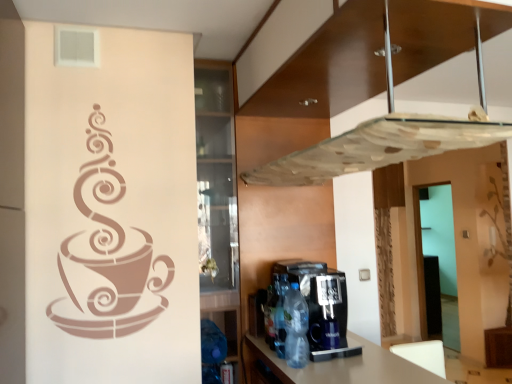
Describe the element at coordinates (439, 261) in the screenshot. The image size is (512, 384). I see `transparent glass door at right` at that location.

The width and height of the screenshot is (512, 384). What do you see at coordinates (322, 307) in the screenshot?
I see `black plastic coffee machine at lower center` at bounding box center [322, 307].

Image resolution: width=512 pixels, height=384 pixels. What do you see at coordinates (331, 65) in the screenshot?
I see `transparent glass exhaust hood at upper center` at bounding box center [331, 65].

Measure the distance between translucent plastic bottle at center, which ranks as the 2th bottle in front-to-back order, and camera.

translucent plastic bottle at center, which ranks as the 2th bottle in front-to-back order, is 5.47 feet from camera.

Describe the element at coordinates (280, 315) in the screenshot. I see `translucent plastic bottle at center, which ranks as the 2th bottle in back-to-front order` at that location.

Where is `translucent plastic bottle at lower center, marked as the 3th bottle in a back-to-front arrangement`? translucent plastic bottle at lower center, marked as the 3th bottle in a back-to-front arrangement is located at coordinates (296, 328).

Does point (444, 223) come behind point (311, 300)?

Yes.

Who is bigger, transparent glass door at right or black plastic coffee machine at lower center?

Bigger between the two is transparent glass door at right.

Considering the relative positions of transparent glass door at right and black plastic coffee machine at lower center in the image provided, is transparent glass door at right to the left of black plastic coffee machine at lower center from the viewer's perspective?

Incorrect, transparent glass door at right is not on the left side of black plastic coffee machine at lower center.

Which is correct: translucent plastic bottle at lower center, marked as the 3th bottle in a back-to-front arrangement, is inside translucent plastic bottle at center, which appears as the third bottle when viewed from the front, or outside of it?

translucent plastic bottle at lower center, marked as the 3th bottle in a back-to-front arrangement, is spatially situated outside translucent plastic bottle at center, which appears as the third bottle when viewed from the front.

Which of these two, translucent plastic bottle at lower center, marked as the 3th bottle in a back-to-front arrangement, or translucent plastic bottle at center, which appears as the third bottle when viewed from the front, stands taller?

With more height is translucent plastic bottle at lower center, marked as the 3th bottle in a back-to-front arrangement.

Can you see translucent plastic bottle at lower center, which is the 1th bottle from front to back, touching translucent plastic bottle at center, which ranks as the 1th bottle in back-to-front order?

No, translucent plastic bottle at lower center, which is the 1th bottle from front to back, is not making contact with translucent plastic bottle at center, which ranks as the 1th bottle in back-to-front order.

Relative to translucent plastic bottle at center, which ranks as the 1th bottle in back-to-front order, is translucent plastic bottle at lower center, which is the 1th bottle from front to back, in front or behind?

In the image, translucent plastic bottle at lower center, which is the 1th bottle from front to back, appears in front of translucent plastic bottle at center, which ranks as the 1th bottle in back-to-front order.

Can you confirm if translucent plastic bottle at center, which ranks as the 2th bottle in back-to-front order, is thinner than translucent plastic bottle at center, which ranks as the 1th bottle in back-to-front order?

In fact, translucent plastic bottle at center, which ranks as the 2th bottle in back-to-front order, might be wider than translucent plastic bottle at center, which ranks as the 1th bottle in back-to-front order.

Is translucent plastic bottle at center, which ranks as the 2th bottle in front-to-back order, not inside translucent plastic bottle at center, which appears as the third bottle when viewed from the front?

translucent plastic bottle at center, which ranks as the 2th bottle in front-to-back order, lies outside translucent plastic bottle at center, which appears as the third bottle when viewed from the front,'s area.

Based on the photo, from the image's perspective, is translucent plastic bottle at center, which ranks as the 2th bottle in back-to-front order, above or below translucent plastic bottle at center, which ranks as the 1th bottle in back-to-front order?

From the image's perspective, translucent plastic bottle at center, which ranks as the 2th bottle in back-to-front order, appears above translucent plastic bottle at center, which ranks as the 1th bottle in back-to-front order.

How many degrees apart are the facing directions of translucent plastic bottle at center, which ranks as the 2th bottle in back-to-front order, and translucent plastic bottle at center, which ranks as the 1th bottle in back-to-front order?

There is a 2.23-degree angle between the facing directions of translucent plastic bottle at center, which ranks as the 2th bottle in back-to-front order, and translucent plastic bottle at center, which ranks as the 1th bottle in back-to-front order.

From the image's perspective, which object appears higher, black plastic coffee machine at lower center or transparent glass exhaust hood at upper center?

transparent glass exhaust hood at upper center, from the image's perspective.

From a real-world perspective, between black plastic coffee machine at lower center and transparent glass exhaust hood at upper center, who is vertically lower?

In real-world perspective, black plastic coffee machine at lower center is lower.

Considering the positions of objects black plastic coffee machine at lower center and transparent glass exhaust hood at upper center in the image provided, who is in front, black plastic coffee machine at lower center or transparent glass exhaust hood at upper center?

Positioned in front is transparent glass exhaust hood at upper center.

Between point (412, 42) and point (281, 342), which one is positioned behind?

The point (281, 342) is farther.

Based on the photo, based on their sizes in the image, would you say transparent glass exhaust hood at upper center is bigger or smaller than translucent plastic bottle at center, which ranks as the 2th bottle in front-to-back order?

In the image, transparent glass exhaust hood at upper center appears to be larger than translucent plastic bottle at center, which ranks as the 2th bottle in front-to-back order.

Is transparent glass exhaust hood at upper center positioned with its back to translucent plastic bottle at center, which ranks as the 2th bottle in front-to-back order?

No.

Which object is thinner, transparent glass exhaust hood at upper center or translucent plastic bottle at center, which appears as the third bottle when viewed from the front?

Thinner between the two is translucent plastic bottle at center, which appears as the third bottle when viewed from the front.

From the image's perspective, which one is positioned lower, transparent glass exhaust hood at upper center or translucent plastic bottle at center, which ranks as the 1th bottle in back-to-front order?

translucent plastic bottle at center, which ranks as the 1th bottle in back-to-front order, is shown below in the image.

Considering the positions of objects transparent glass exhaust hood at upper center and translucent plastic bottle at center, which ranks as the 1th bottle in back-to-front order, in the image provided, who is behind, transparent glass exhaust hood at upper center or translucent plastic bottle at center, which ranks as the 1th bottle in back-to-front order,?

Positioned behind is translucent plastic bottle at center, which ranks as the 1th bottle in back-to-front order.

Considering the relative sizes of transparent glass exhaust hood at upper center and translucent plastic bottle at center, which ranks as the 1th bottle in back-to-front order, in the image provided, is transparent glass exhaust hood at upper center shorter than translucent plastic bottle at center, which ranks as the 1th bottle in back-to-front order,?

No.

Is translucent plastic bottle at center, which ranks as the 1th bottle in back-to-front order, wider than translucent plastic bottle at lower center, marked as the 3th bottle in a back-to-front arrangement?

In fact, translucent plastic bottle at center, which ranks as the 1th bottle in back-to-front order, might be narrower than translucent plastic bottle at lower center, marked as the 3th bottle in a back-to-front arrangement.

Can we say translucent plastic bottle at center, which ranks as the 1th bottle in back-to-front order, lies outside translucent plastic bottle at lower center, which is the 1th bottle from front to back?

That's correct, translucent plastic bottle at center, which ranks as the 1th bottle in back-to-front order, is outside of translucent plastic bottle at lower center, which is the 1th bottle from front to back.

From the image's perspective, which object appears higher, translucent plastic bottle at center, which appears as the third bottle when viewed from the front, or translucent plastic bottle at lower center, which is the 1th bottle from front to back?

translucent plastic bottle at lower center, which is the 1th bottle from front to back, is shown above in the image.

Locate an element on the screen. This screenshot has height=384, width=512. the 2nd bottle counting from the right of the translucent plastic bottle at center, which appears as the third bottle when viewed from the front is located at coordinates (296, 328).

This screenshot has height=384, width=512. In order to click on glass door below the black plastic coffee machine at lower center (from a real-world perspective) in this screenshot , I will do 439,261.

The width and height of the screenshot is (512, 384). In order to click on the 2nd bottle in front when counting from the translucent plastic bottle at center, which ranks as the 1th bottle in back-to-front order in this screenshot , I will do `click(296, 328)`.

Which object lies further to the anchor point translucent plastic bottle at center, which ranks as the 2th bottle in back-to-front order, translucent plastic bottle at center, which appears as the third bottle when viewed from the front, or transparent glass door at right?

transparent glass door at right lies further to translucent plastic bottle at center, which ranks as the 2th bottle in back-to-front order, than the other object.

Based on their spatial positions, is transparent glass door at right or black plastic coffee machine at lower center closer to translucent plastic bottle at center, which ranks as the 2th bottle in front-to-back order?

black plastic coffee machine at lower center.

When comparing their distances from translucent plastic bottle at lower center, which is the 1th bottle from front to back, does black plastic coffee machine at lower center or transparent glass exhaust hood at upper center seem further?

transparent glass exhaust hood at upper center is positioned further to the anchor translucent plastic bottle at lower center, which is the 1th bottle from front to back.

Based on their spatial positions, is transparent glass door at right or translucent plastic bottle at center, which ranks as the 2th bottle in back-to-front order, further from transparent glass exhaust hood at upper center?

transparent glass door at right is positioned further to the anchor transparent glass exhaust hood at upper center.

Estimate the real-world distances between objects in this image. Which object is further from transparent glass door at right, translucent plastic bottle at center, which ranks as the 2th bottle in back-to-front order, or black plastic coffee machine at lower center?

Based on the image, translucent plastic bottle at center, which ranks as the 2th bottle in back-to-front order, appears to be further to transparent glass door at right.

From the image, which object appears to be nearer to transparent glass exhaust hood at upper center, black plastic coffee machine at lower center or translucent plastic bottle at lower center, marked as the 3th bottle in a back-to-front arrangement?

The object closer to transparent glass exhaust hood at upper center is black plastic coffee machine at lower center.

Consider the image. Considering their positions, is translucent plastic bottle at lower center, marked as the 3th bottle in a back-to-front arrangement, positioned further to transparent glass door at right than transparent glass exhaust hood at upper center?

Among the two, transparent glass exhaust hood at upper center is located further to transparent glass door at right.

When comparing their distances from translucent plastic bottle at center, which ranks as the 1th bottle in back-to-front order, does transparent glass exhaust hood at upper center or transparent glass door at right seem further?

The object further to translucent plastic bottle at center, which ranks as the 1th bottle in back-to-front order, is transparent glass door at right.

Locate an element on the screen. coffee machine that lies between transparent glass exhaust hood at upper center and translucent plastic bottle at lower center, marked as the 3th bottle in a back-to-front arrangement, from top to bottom is located at coordinates (322, 307).

Locate an element on the screen. The height and width of the screenshot is (384, 512). coffee machine between transparent glass exhaust hood at upper center and translucent plastic bottle at center, which appears as the third bottle when viewed from the front, along the z-axis is located at coordinates (322, 307).

You are a GUI agent. You are given a task and a screenshot of the screen. Output one action in this format:
    pyautogui.click(x=<x>, y=<y>)
    Task: Click on the bottle between translucent plastic bottle at lower center, marked as the 3th bottle in a back-to-front arrangement, and translucent plastic bottle at center, which ranks as the 1th bottle in back-to-front order, in the front-back direction
    
    Given the screenshot: What is the action you would take?
    pyautogui.click(x=280, y=315)

This screenshot has height=384, width=512. I want to click on coffee machine located between transparent glass exhaust hood at upper center and transparent glass door at right in the depth direction, so click(x=322, y=307).